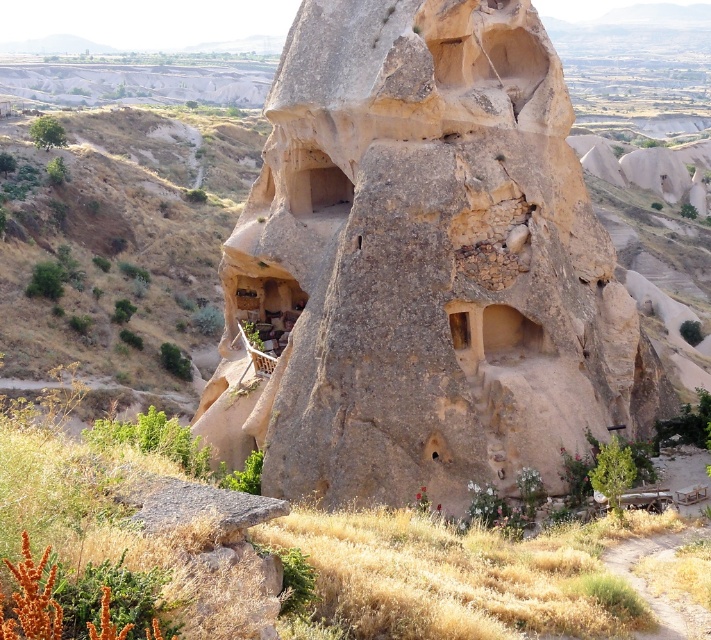
Question: Is brown rough rock formation at center to the left of brown rough rock at lower left from the viewer's perspective?

Choices:
 (A) yes
 (B) no

Answer: (B)

Question: Does brown rough rock formation at center appear on the left side of brown rough rock at lower left?

Choices:
 (A) no
 (B) yes

Answer: (A)

Question: Which point is closer to the camera?

Choices:
 (A) brown rough rock formation at center
 (B) brown rough rock at lower left

Answer: (A)

Question: Does brown rough rock formation at center appear over brown rough rock at lower left?

Choices:
 (A) yes
 (B) no

Answer: (B)

Question: Which point appears closest to the camera in this image?

Choices:
 (A) (432, 205)
 (B) (235, 170)

Answer: (A)

Question: Which point appears farthest from the camera in this image?

Choices:
 (A) (173, 240)
 (B) (406, 342)

Answer: (A)